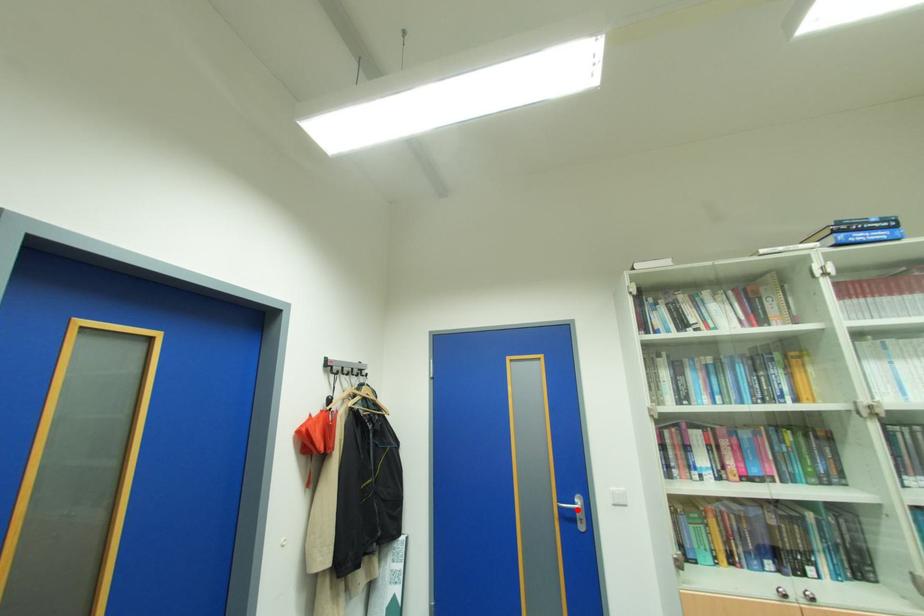
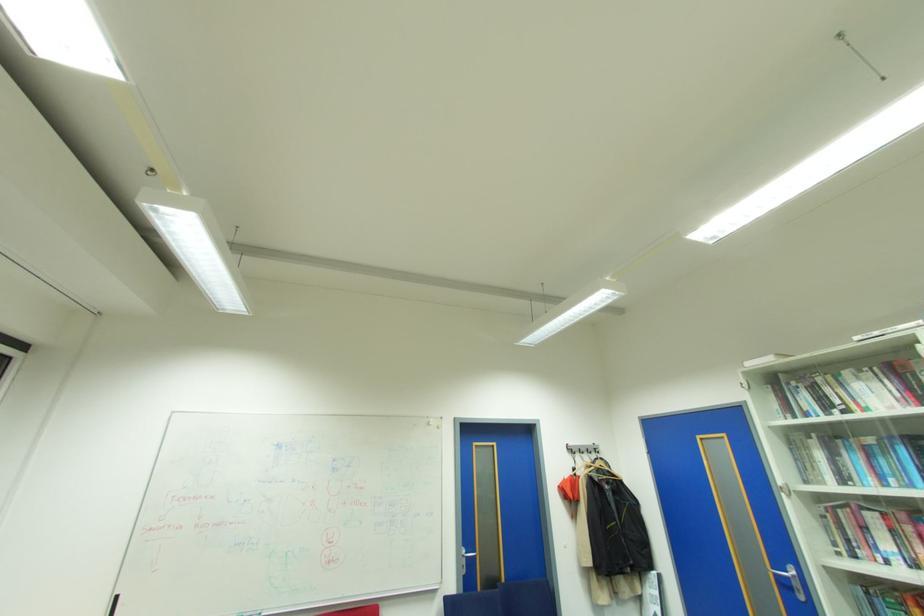
Question: A red point is marked in image1. In image2, is the corresponding 3D point closer to the camera or farther? Reply with the corresponding letter.

Choices:
 (A) The corresponding 3D point is closer.
 (B) The corresponding 3D point is farther.

Answer: (A)